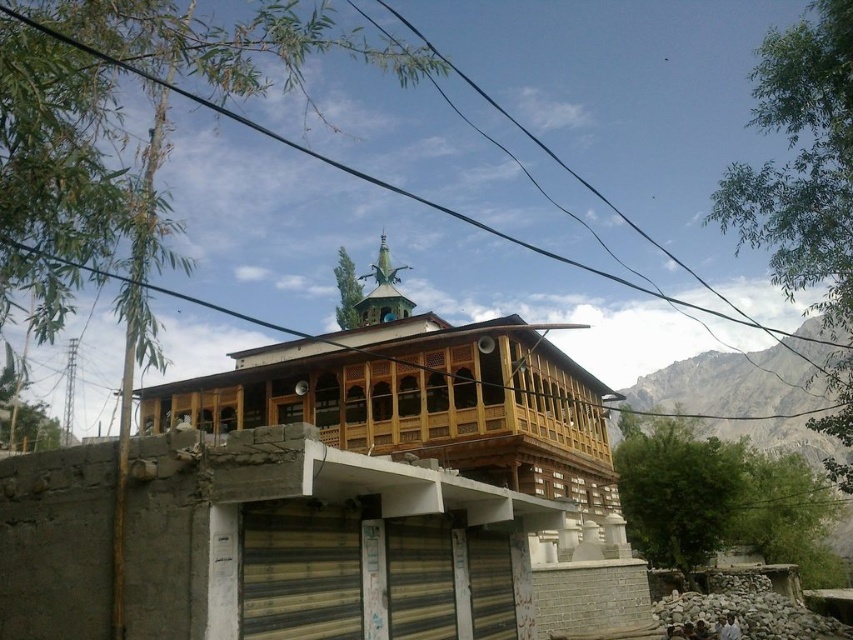
Question: Which of the following is the closest to the observer?

Choices:
 (A) (460, 380)
 (B) (548, 124)

Answer: (A)

Question: Among these points, which one is nearest to the camera?

Choices:
 (A) (682, 140)
 (B) (4, 524)

Answer: (B)

Question: Can you confirm if wooden mosque at center is smaller than black wire at upper center?

Choices:
 (A) no
 (B) yes

Answer: (B)

Question: Which object appears closest to the camera in this image?

Choices:
 (A) wooden mosque at center
 (B) black wire at upper center

Answer: (B)

Question: Is wooden mosque at center smaller than black wire at upper center?

Choices:
 (A) yes
 (B) no

Answer: (A)

Question: Is wooden mosque at center smaller than black wire at upper center?

Choices:
 (A) no
 (B) yes

Answer: (B)